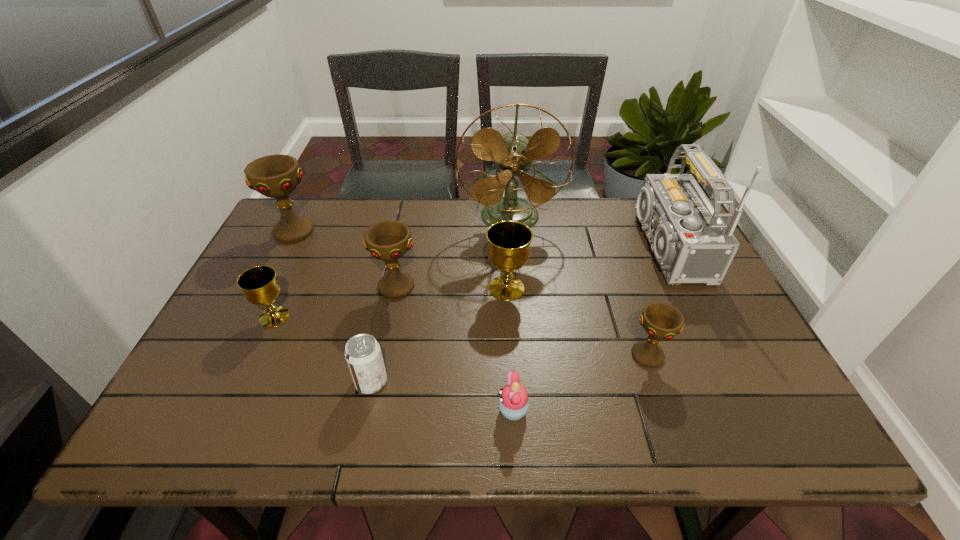
Find the location of a particular element. This screenshot has height=540, width=960. the smallest red chalice is located at coordinates (660, 320).

Where is `the nearest chalice`? The width and height of the screenshot is (960, 540). the nearest chalice is located at coordinates (660, 320).

In order to click on soda can in this screenshot , I will do click(x=363, y=355).

This screenshot has height=540, width=960. What are the coordinates of `the shortest object` in the screenshot? It's located at (513, 402).

Where is `free spot located 0.150m in front of the fan, directing air flow`? free spot located 0.150m in front of the fan, directing air flow is located at coordinates (515, 270).

Find the location of a particular element. This screenshot has height=540, width=960. free spot located on the front-facing side of the gray radio receiver is located at coordinates (588, 247).

At what (x,y) coordinates should I click in order to perform the action: click on vacant area situated 0.350m on the front-facing side of the gray radio receiver. Please return your answer as a coordinate pair (x, y). Looking at the image, I should click on (507, 247).

Image resolution: width=960 pixels, height=540 pixels. What are the coordinates of `vacant space located on the front-facing side of the gray radio receiver` in the screenshot? It's located at (609, 247).

What are the coordinates of `vacant space located on the front of the tallest chalice` in the screenshot? It's located at (260, 298).

Locate an element on the screen. This screenshot has height=540, width=960. free space located 0.190m on the front of the second red chalice from left to right is located at coordinates (381, 363).